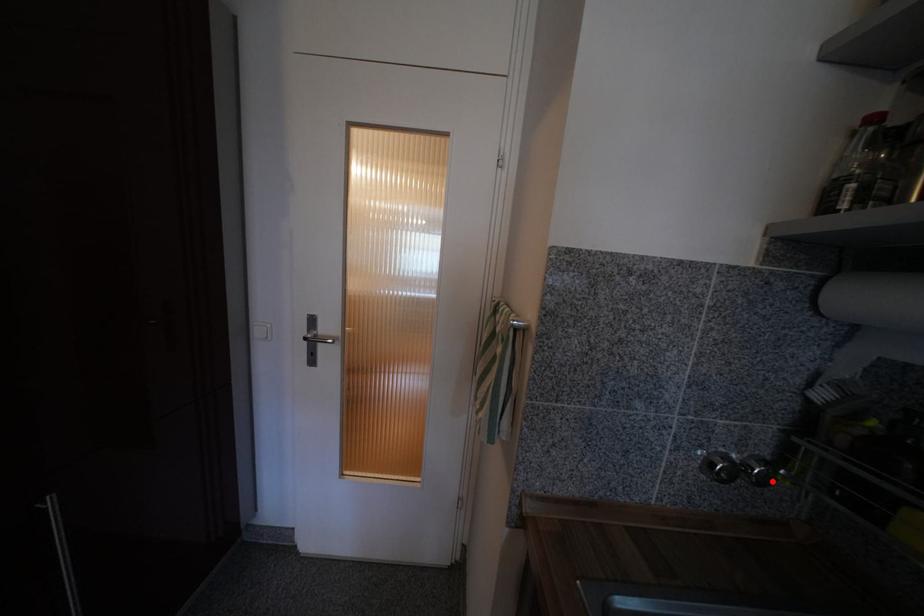
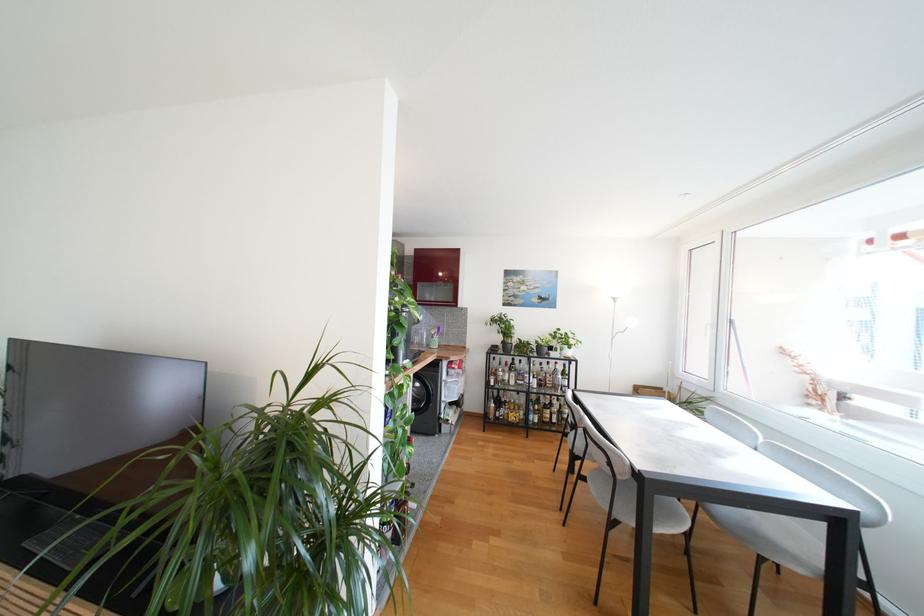
Question: I am providing you with two images of the same scene from different viewpoints. A red point is marked on the first image. Is the red point's position out of view in image 2?

Choices:
 (A) Yes
 (B) No

Answer: (A)